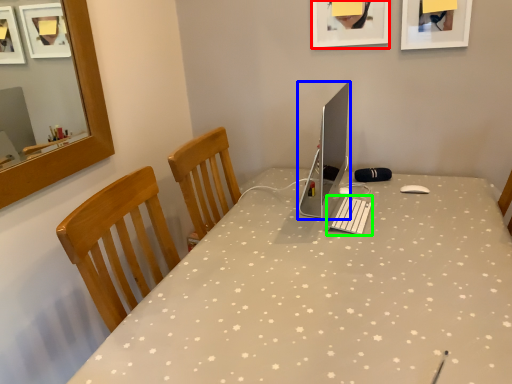
Question: Considering the real-world distances, which object is closest to picture frame (highlighted by a red box)? computer monitor (highlighted by a blue box) or laptop keyboard (highlighted by a green box).

Choices:
 (A) computer monitor
 (B) laptop keyboard

Answer: (A)